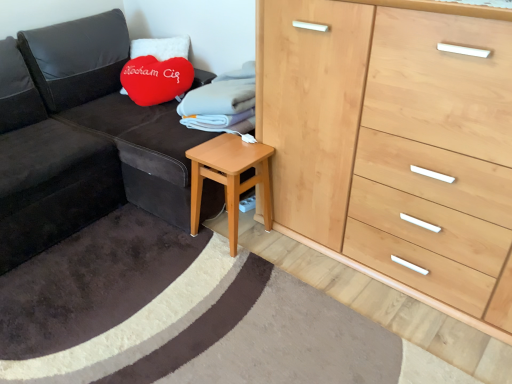
Question: Considering the relative sizes of natural wood chest of drawers at right and velvety red heart-shaped pillow at upper left in the image provided, is natural wood chest of drawers at right thinner than velvety red heart-shaped pillow at upper left?

Choices:
 (A) yes
 (B) no

Answer: (B)

Question: Is natural wood chest of drawers at right positioned far away from velvety red heart-shaped pillow at upper left?

Choices:
 (A) yes
 (B) no

Answer: (A)

Question: From a real-world perspective, is natural wood chest of drawers at right located beneath velvety red heart-shaped pillow at upper left?

Choices:
 (A) yes
 (B) no

Answer: (A)

Question: From the image's perspective, would you say natural wood chest of drawers at right is shown under velvety red heart-shaped pillow at upper left?

Choices:
 (A) yes
 (B) no

Answer: (A)

Question: Can you confirm if natural wood chest of drawers at right is shorter than velvety red heart-shaped pillow at upper left?

Choices:
 (A) yes
 (B) no

Answer: (B)

Question: Based on their positions, is light brown wooden stool at lower center located to the left or right of natural wood chest of drawers at right?

Choices:
 (A) left
 (B) right

Answer: (A)

Question: Would you say light brown wooden stool at lower center is inside or outside natural wood chest of drawers at right?

Choices:
 (A) outside
 (B) inside

Answer: (A)

Question: Is light brown wooden stool at lower center in front of or behind natural wood chest of drawers at right in the image?

Choices:
 (A) front
 (B) behind

Answer: (B)

Question: From the image's perspective, relative to natural wood chest of drawers at right, is light brown wooden stool at lower center above or below?

Choices:
 (A) below
 (B) above

Answer: (A)

Question: Is velvety red heart-shaped pillow at upper left wider or thinner than natural wood chest of drawers at right?

Choices:
 (A) wide
 (B) thin

Answer: (B)

Question: Would you say velvety red heart-shaped pillow at upper left is to the left or to the right of natural wood chest of drawers at right in the picture?

Choices:
 (A) right
 (B) left

Answer: (B)

Question: From the image's perspective, is velvety red heart-shaped pillow at upper left positioned above or below natural wood chest of drawers at right?

Choices:
 (A) below
 (B) above

Answer: (B)

Question: Which is correct: velvety red heart-shaped pillow at upper left is inside natural wood chest of drawers at right, or outside of it?

Choices:
 (A) outside
 (B) inside

Answer: (A)

Question: Based on their sizes in the image, would you say velvet dark gray couch at left is bigger or smaller than light brown wooden stool at lower center?

Choices:
 (A) small
 (B) big

Answer: (B)

Question: Would you say velvet dark gray couch at left is to the left or to the right of light brown wooden stool at lower center in the picture?

Choices:
 (A) right
 (B) left

Answer: (B)